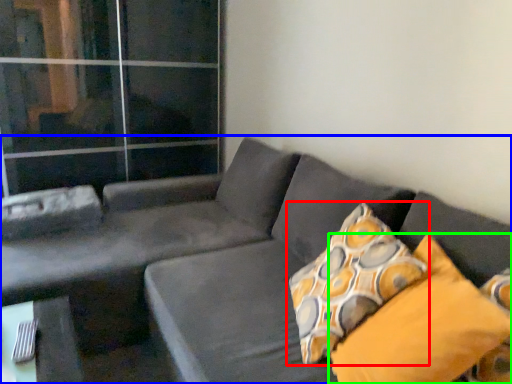
Question: Which object is the farthest from pillow (highlighted by a red box)? Choose among these: studio couch (highlighted by a blue box) or pillow (highlighted by a green box).

Choices:
 (A) studio couch
 (B) pillow

Answer: (A)